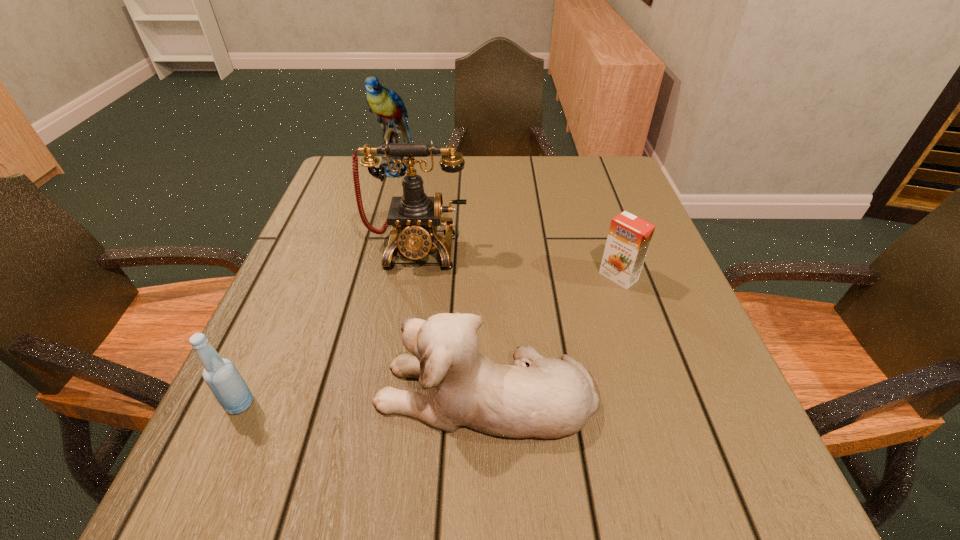
Locate an element on the screen. Image resolution: width=960 pixels, height=540 pixels. parrot is located at coordinates (387, 106).

Find the location of a particular element. telephone is located at coordinates (414, 217).

Identify the location of puppy. (553, 398).

Identify the location of bottle. The width and height of the screenshot is (960, 540). (222, 377).

Locate an element on the screen. Image resolution: width=960 pixels, height=540 pixels. orange juice is located at coordinates (629, 237).

Where is `the rightmost object`? the rightmost object is located at coordinates (629, 237).

You are a GUI agent. You are given a task and a screenshot of the screen. Output one action in this format:
    pyautogui.click(x=<x>, y=<y>)
    Task: Click on the free region located 0.310m on the face of the parrot
    The image size is (960, 540).
    Given the screenshot: What is the action you would take?
    pyautogui.click(x=371, y=256)

Where is `free space located on the front of the telephone, featuring the rotary dial`? This screenshot has height=540, width=960. free space located on the front of the telephone, featuring the rotary dial is located at coordinates (394, 390).

Image resolution: width=960 pixels, height=540 pixels. I want to click on vacant space located 0.130m on the front-facing side of the puppy, so click(x=294, y=393).

Find the location of a particular element. The height and width of the screenshot is (540, 960). vacant region located 0.120m on the front-facing side of the puppy is located at coordinates (300, 393).